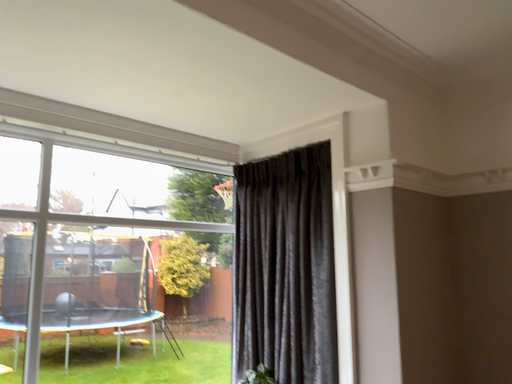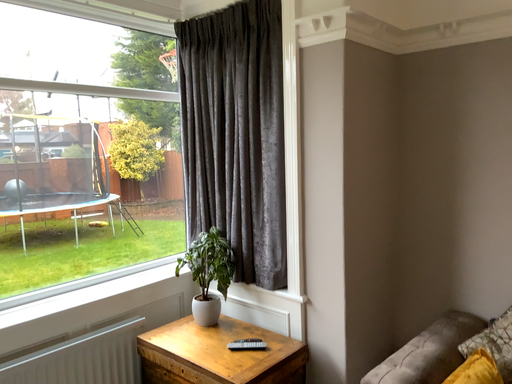
Question: Which way did the camera rotate in the video?

Choices:
 (A) rotated upward
 (B) rotated downward

Answer: (B)